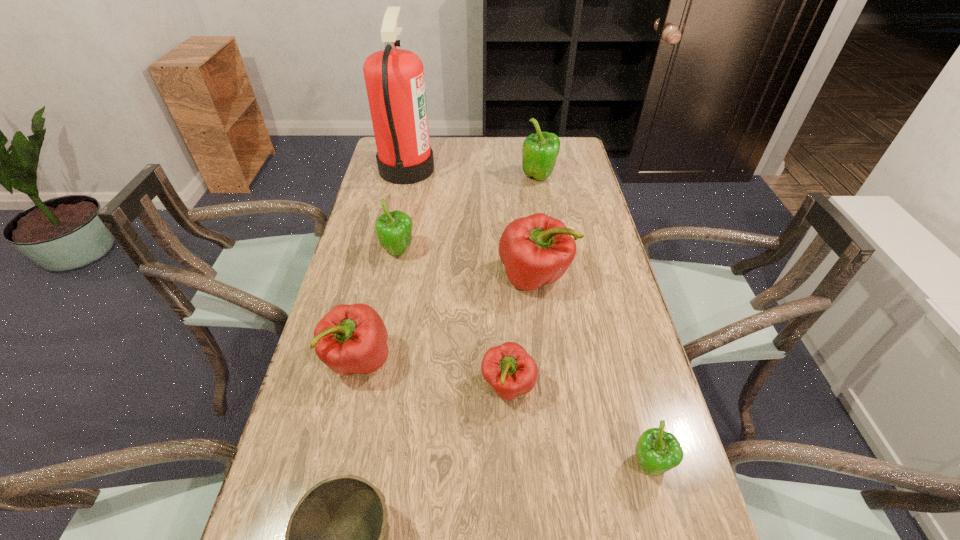
At what (x,y) coordinates should I click in order to perform the action: click on the smallest pink bell pepper. Please return your answer as a coordinate pair (x, y). Looking at the image, I should click on pyautogui.click(x=510, y=371).

The width and height of the screenshot is (960, 540). Identify the location of vacant space located at the nozzle of the red fire extinguisher. (463, 169).

This screenshot has height=540, width=960. I want to click on vacant point located on the right of the farthest bell pepper, so click(583, 178).

The image size is (960, 540). I want to click on free spot located on the left of the farthest pink bell pepper, so click(388, 277).

The image size is (960, 540). I want to click on vacant space located on the front of the second farthest green bell pepper, so click(377, 359).

Identify the location of vacant space located 0.230m on the back of the second smallest pink bell pepper. This screenshot has height=540, width=960. (379, 272).

The width and height of the screenshot is (960, 540). In order to click on free space located on the left of the smallest green bell pepper in this screenshot , I will do `click(542, 465)`.

The width and height of the screenshot is (960, 540). Identify the location of free spot located on the right of the smallest pink bell pepper. (565, 387).

You are a GUI agent. You are given a task and a screenshot of the screen. Output one action in this format:
    pyautogui.click(x=<x>, y=<y>)
    Task: Click on the object located in the far edge section of the desktop
    
    Given the screenshot: What is the action you would take?
    pyautogui.click(x=394, y=78)

Image resolution: width=960 pixels, height=540 pixels. I want to click on fire extinguisher that is positioned at the left edge, so click(394, 78).